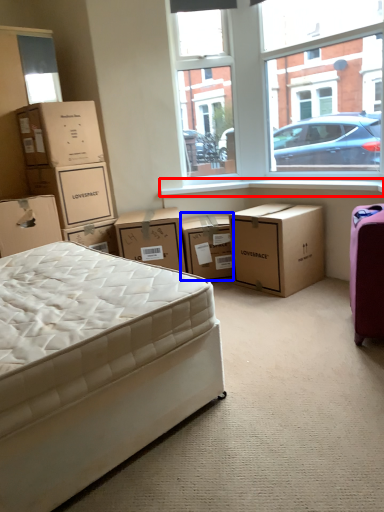
Question: Which object is closer to the camera taking this photo, window sill (highlighted by a red box) or box (highlighted by a blue box)?

Choices:
 (A) window sill
 (B) box

Answer: (A)